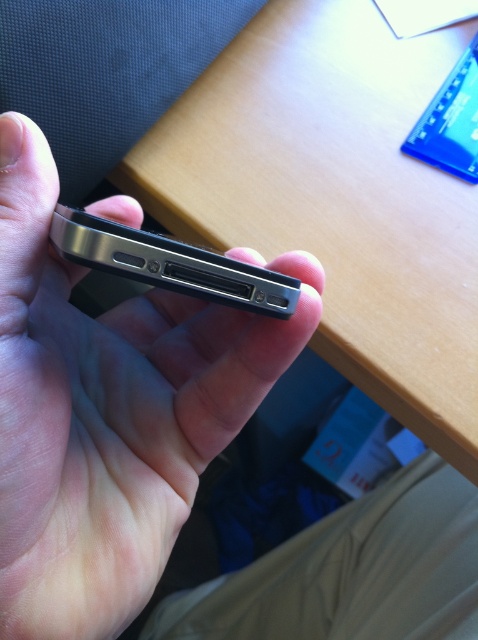
You are designing a phone case for the black matte phone at center. The case needs to cover the entire back of the phone. To ensure proper fit, you need to know the phone dimensions. Can you determine the phone dimensions based on its position in the image?

The position of black matte phone at center is at point (x=108, y=413), but this information only indicates its location in the image frame and does not provide any details about its actual physical dimensions. Therefore, the phone dimensions cannot be determined from the given position data.

You are trying to place a small object on the wooden table at center while holding the satin black smartphone at center. In which direction should you move the smartphone to reach the table?

You should move the satin black smartphone at center to the right to reach the wooden table at center because the wooden table at center is located to the right of the smartphone.